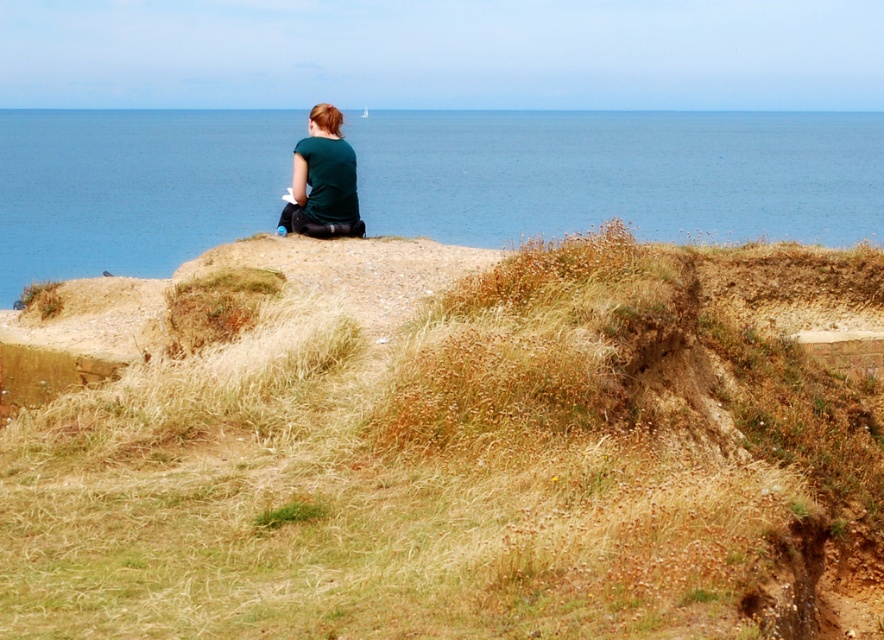
Measure the distance between brown grassy hillside at upper center and camera.

5.51 meters

Who is positioned more to the right, brown grassy hillside at upper center or matte green shirt at center?

From the viewer's perspective, brown grassy hillside at upper center appears more on the right side.

Identify the location of brown grassy hillside at upper center. Image resolution: width=884 pixels, height=640 pixels. (456, 448).

Does blue water at upper center have a larger size compared to matte green shirt at center?

Correct, blue water at upper center is larger in size than matte green shirt at center.

Does blue water at upper center have a lesser width compared to matte green shirt at center?

No, blue water at upper center is not thinner than matte green shirt at center.

Locate an element on the screen. This screenshot has width=884, height=640. blue water at upper center is located at coordinates (620, 173).

Can you confirm if brown grassy hillside at upper center is smaller than blue water at upper center?

Yes, brown grassy hillside at upper center is smaller than blue water at upper center.

Is point (309, 564) positioned behind point (177, 230)?

No, (309, 564) is in front of (177, 230).

Locate an element on the screen. The width and height of the screenshot is (884, 640). brown grassy hillside at upper center is located at coordinates (456, 448).